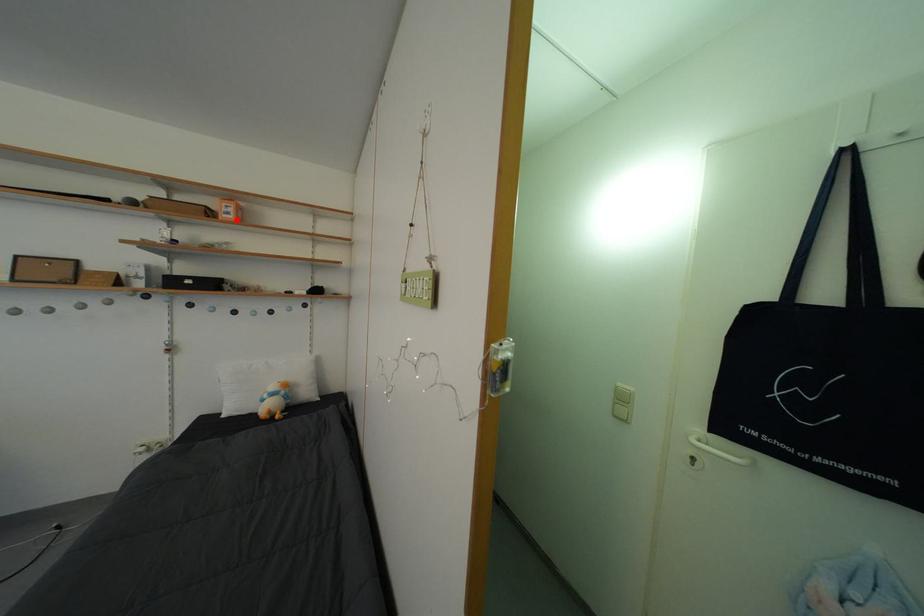
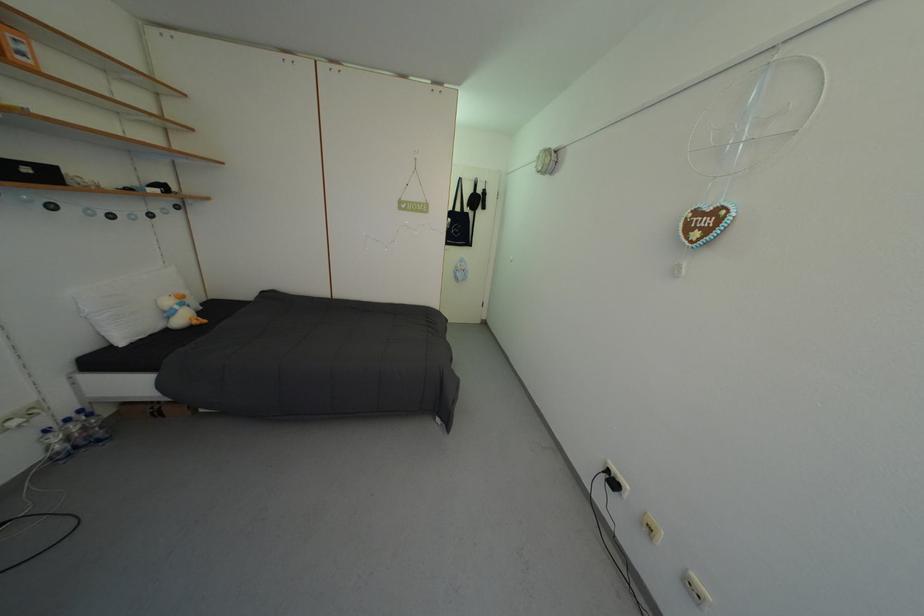
Question: I am providing you with two images of the same scene from different viewpoints. A red point is marked on the first image. At the location where the point appears in image 1, is it still visible in image 2?

Choices:
 (A) Yes
 (B) No

Answer: (A)